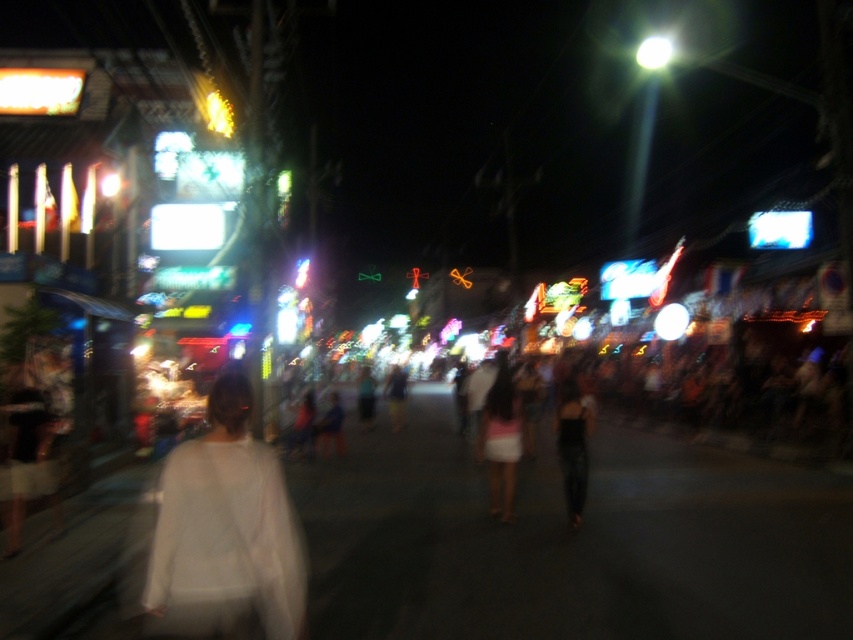
Question: Can you confirm if pink fabric skirt at center is positioned above matte black dress at center?

Choices:
 (A) yes
 (B) no

Answer: (B)

Question: Which of the following is the closest to the observer?

Choices:
 (A) matte black dress at center
 (B) white matte shirt at center

Answer: (B)

Question: Which point is closer to the camera taking this photo?

Choices:
 (A) (563, 436)
 (B) (505, 397)
 (C) (219, 600)

Answer: (C)

Question: Is white matte shirt at center to the right of pink fabric skirt at center from the viewer's perspective?

Choices:
 (A) no
 (B) yes

Answer: (A)

Question: Among these points, which one is nearest to the camera?

Choices:
 (A) (178, 470)
 (B) (490, 456)

Answer: (A)

Question: Is white matte shirt at center smaller than matte black dress at center?

Choices:
 (A) no
 (B) yes

Answer: (A)